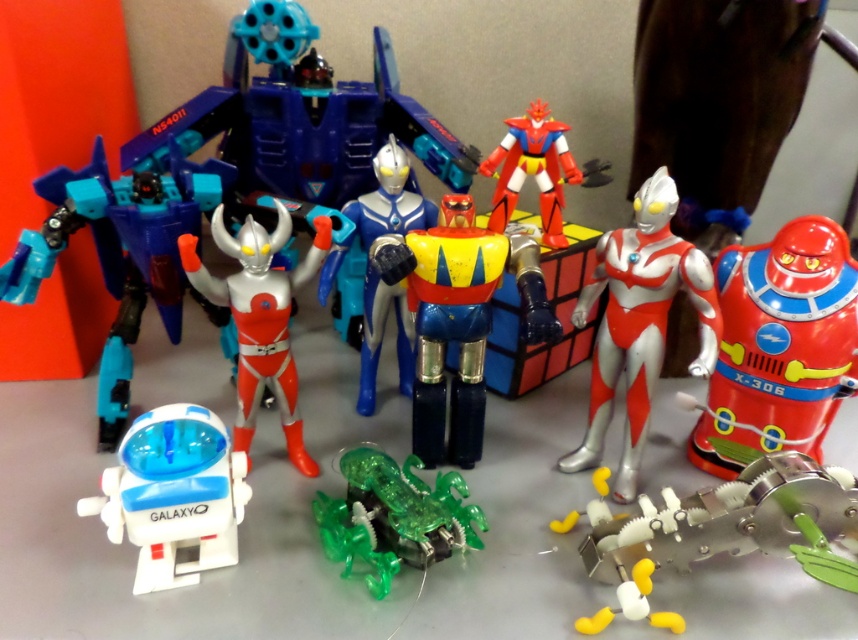
Question: Among these points, which one is nearest to the camera?

Choices:
 (A) (80, 188)
 (B) (301, 451)
 (C) (607, 560)
 (D) (216, 461)

Answer: (C)

Question: Estimate the real-world distances between objects in this image. Which object is closer to the matte blue plastic robot at left?

Choices:
 (A) white plastic robot at lower left
 (B) transparent green creature at center
 (C) red shiny tin robot at right

Answer: (A)

Question: Which of these objects is positioned farthest from the metallic blue robot at center?

Choices:
 (A) matte blue plastic robot at left
 (B) silver/metallic ultraman at center
 (C) red shiny tin robot at right

Answer: (A)

Question: Does matte blue plastic robot at left appear over metallic blue robot at center?

Choices:
 (A) no
 (B) yes

Answer: (B)

Question: Can you confirm if matte blue plastic robot at left is smaller than metallic blue robot at center?

Choices:
 (A) no
 (B) yes

Answer: (A)

Question: Can you confirm if red shiny tin robot at right is thinner than silver/metallic ultraman at center?

Choices:
 (A) no
 (B) yes

Answer: (B)